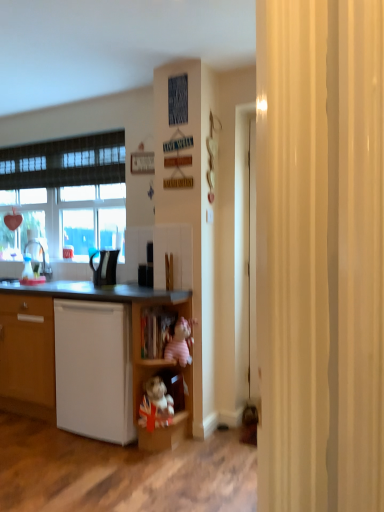
In order to click on vacant area that lies to the right of wooden shelf at center in this screenshot , I will do `click(215, 445)`.